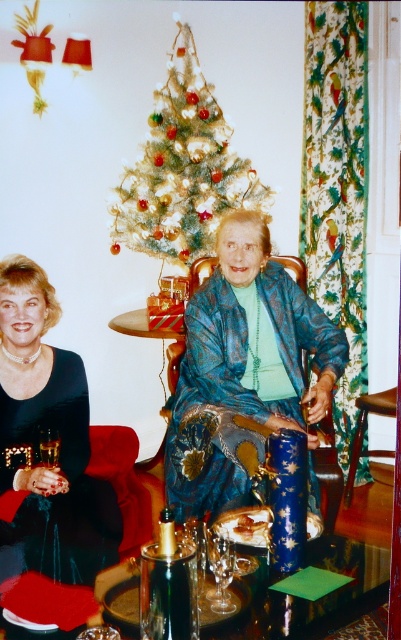
Question: Which object is the farthest from the red velvet couch at lower left?

Choices:
 (A) translucent glass bottle at lower left
 (B) black velvet dress at left
 (C) blue textured dress at center

Answer: (C)

Question: Among these objects, which one is farthest from the camera?

Choices:
 (A) black velvet dress at left
 (B) velvet black dress at left
 (C) translucent glass bottle at lower left
 (D) clear glass wine glass at center

Answer: (C)

Question: Is red velvet couch at lower left thinner than translucent glass bottle at lower left?

Choices:
 (A) no
 (B) yes

Answer: (A)

Question: Is white frosted christmas tree at center thinner than clear glass wine glass at center?

Choices:
 (A) yes
 (B) no

Answer: (B)

Question: Which is nearer to the velvet black dress at left?

Choices:
 (A) clear glass wine glass at center
 (B) translucent glass bottle at lower left
 (C) black velvet dress at left

Answer: (C)

Question: In this image, where is white frosted christmas tree at center located relative to clear glass wine glass at center?

Choices:
 (A) right
 (B) left

Answer: (B)